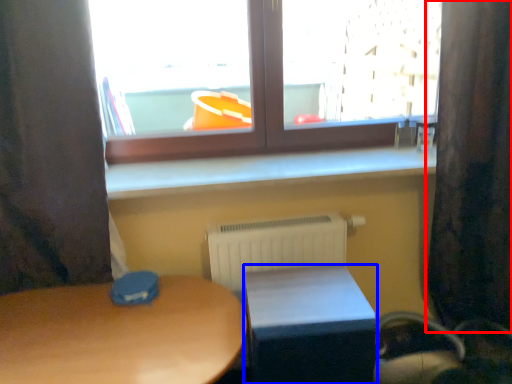
Question: Which object appears farthest to the camera in this image, curtain (highlighted by a red box) or table (highlighted by a blue box)?

Choices:
 (A) curtain
 (B) table

Answer: (A)